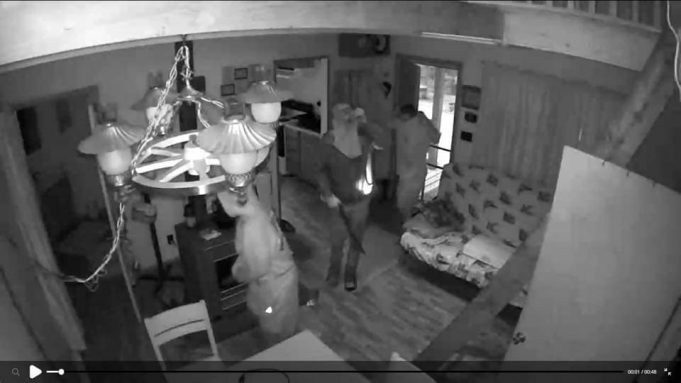
The width and height of the screenshot is (681, 383). In order to click on lamp cord in this screenshot , I will do `click(95, 267)`, `click(165, 84)`, `click(191, 69)`, `click(199, 114)`, `click(214, 101)`.